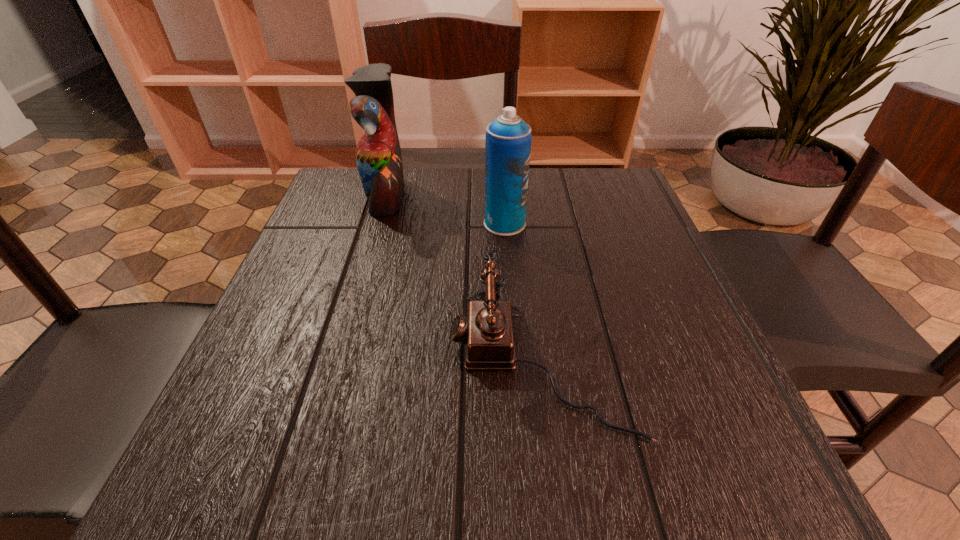
Where is `aerosol can that is at the far edge`? aerosol can that is at the far edge is located at coordinates 508,140.

Locate an element on the screen. object located at the near edge is located at coordinates (487, 332).

Locate an element on the screen. object that is at the left edge is located at coordinates (378, 155).

Find the location of a particular element. The image size is (960, 540). object that is at the right edge is located at coordinates (487, 332).

Locate an element on the screen. object present at the far left corner is located at coordinates (378, 155).

In order to click on object situated at the near right corner in this screenshot , I will do `click(487, 332)`.

Identify the location of free location at the far edge. (539, 219).

In the image, there is a desktop. Where is `free space at the near edge`? free space at the near edge is located at coordinates (468, 495).

The image size is (960, 540). In the image, there is a desktop. Identify the location of vacant space at the left edge. (341, 282).

Identify the location of vacant space at the right edge. (588, 228).